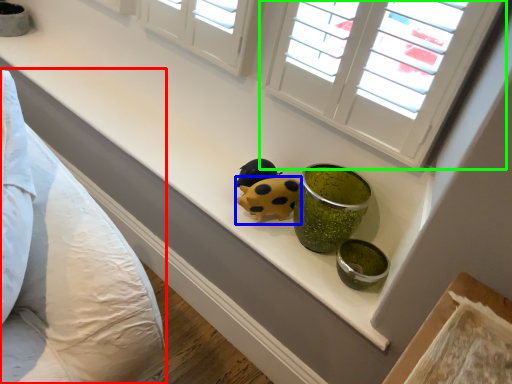
Question: Which object is the closest to the bedding (highlighted by a red box)? Choose among these: ladybug (highlighted by a blue box) or window (highlighted by a green box).

Choices:
 (A) ladybug
 (B) window

Answer: (A)